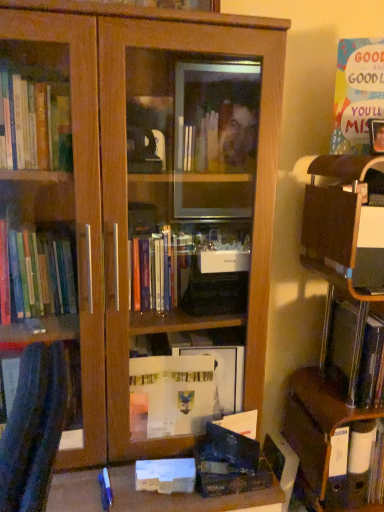
Question: Is matte black paperback book at lower center, positioned as the second paperback book in bottom-to-top order, located within metallic silver book at right?

Choices:
 (A) no
 (B) yes

Answer: (A)

Question: From the image's perspective, does metallic silver book at right appear lower than matte black paperback book at lower center, the second paperback book positioned from the top?

Choices:
 (A) yes
 (B) no

Answer: (B)

Question: Can you see metallic silver book at right touching matte black paperback book at lower center, positioned as the second paperback book in bottom-to-top order?

Choices:
 (A) no
 (B) yes

Answer: (A)

Question: Is metallic silver book at right shorter than matte black paperback book at lower center, positioned as the second paperback book in bottom-to-top order?

Choices:
 (A) yes
 (B) no

Answer: (B)

Question: Does metallic silver book at right lie behind matte black paperback book at lower center, the 2th paperback book in the right-to-left sequence?

Choices:
 (A) no
 (B) yes

Answer: (B)

Question: Considering the positions of point (370, 296) and point (311, 481), is point (370, 296) closer or farther from the camera than point (311, 481)?

Choices:
 (A) closer
 (B) farther

Answer: (A)

Question: Is wooden desk at right bigger or smaller than matte brown cabinet at lower right?

Choices:
 (A) small
 (B) big

Answer: (B)

Question: Is wooden desk at right in front of or behind matte brown cabinet at lower right in the image?

Choices:
 (A) behind
 (B) front

Answer: (B)

Question: Do you think wooden desk at right is within matte brown cabinet at lower right, or outside of it?

Choices:
 (A) inside
 (B) outside

Answer: (B)

Question: Considering the positions of matte brown cabinet at lower right and metallic silver book at right in the image, is matte brown cabinet at lower right taller or shorter than metallic silver book at right?

Choices:
 (A) short
 (B) tall

Answer: (A)

Question: Is matte brown cabinet at lower right in front of or behind metallic silver book at right in the image?

Choices:
 (A) front
 (B) behind

Answer: (B)

Question: From a real-world perspective, is matte brown cabinet at lower right physically located above or below metallic silver book at right?

Choices:
 (A) above
 (B) below

Answer: (B)

Question: Considering the positions of point (334, 413) and point (359, 373), is point (334, 413) closer or farther from the camera than point (359, 373)?

Choices:
 (A) farther
 (B) closer

Answer: (A)

Question: Is point (324, 372) closer or farther from the camera than point (355, 111)?

Choices:
 (A) closer
 (B) farther

Answer: (B)

Question: Considering the positions of wooden desk at right and multicolored paper at upper right, the 3th paperback book from the left, in the image, is wooden desk at right wider or thinner than multicolored paper at upper right, the 3th paperback book from the left,?

Choices:
 (A) thin
 (B) wide

Answer: (B)